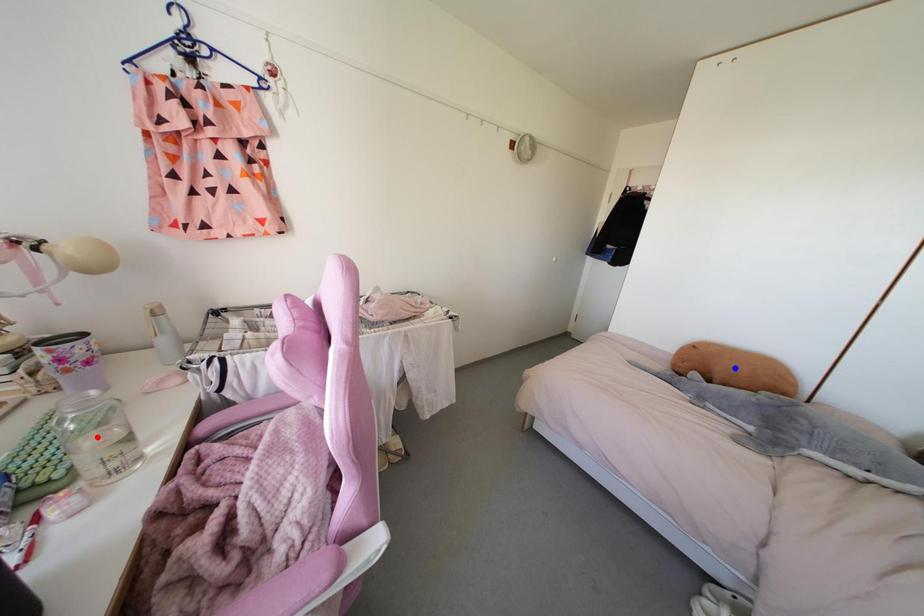
Question: Which of the two points in the image is closer to the camera?

Choices:
 (A) Blue point is closer.
 (B) Red point is closer.

Answer: (B)